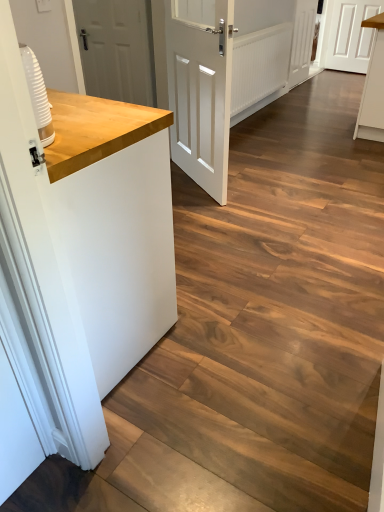
Question: Considering the relative sizes of wooden countertop at left and white matte door at center, which appears as the 3th door when viewed from the right, in the image provided, is wooden countertop at left thinner than white matte door at center, which appears as the 3th door when viewed from the right,?

Choices:
 (A) no
 (B) yes

Answer: (A)

Question: From a real-world perspective, is wooden countertop at left under white matte door at center, which appears as the 1th door when viewed from the front?

Choices:
 (A) no
 (B) yes

Answer: (B)

Question: Considering the relative sizes of wooden countertop at left and white matte door at center, acting as the second door starting from the left, in the image provided, is wooden countertop at left bigger than white matte door at center, acting as the second door starting from the left,?

Choices:
 (A) yes
 (B) no

Answer: (A)

Question: From a real-world perspective, is wooden countertop at left located higher than white matte door at center, acting as the second door starting from the left?

Choices:
 (A) yes
 (B) no

Answer: (B)

Question: Is white matte door at center, which appears as the 3th door when viewed from the right, surrounded by wooden countertop at left?

Choices:
 (A) no
 (B) yes

Answer: (A)

Question: From their relative heights in the image, would you say white matte door at upper left, which is the second door from front to back, is taller or shorter than white wooden door at upper right, positioned as the 1th door in right-to-left order?

Choices:
 (A) tall
 (B) short

Answer: (B)

Question: Considering their positions, is white matte door at upper left, the 3th door in the back-to-front sequence, located in front of or behind white wooden door at upper right, the 4th door in the front-to-back sequence?

Choices:
 (A) front
 (B) behind

Answer: (A)

Question: Looking at their shapes, would you say white matte door at upper left, which is the 4th door in right-to-left order, is wider or thinner than white wooden door at upper right, placed as the 4th door when sorted from left to right?

Choices:
 (A) thin
 (B) wide

Answer: (A)

Question: Would you say white matte door at upper left, which is the 4th door in right-to-left order, is to the left or to the right of white wooden door at upper right, placed as the 4th door when sorted from left to right, in the picture?

Choices:
 (A) left
 (B) right

Answer: (A)

Question: Based on their positions, is white matte door at upper left, which is the 4th door in right-to-left order, located to the left or right of white matte cabinet at upper right?

Choices:
 (A) left
 (B) right

Answer: (A)

Question: In terms of height, does white matte door at upper left, which is the 4th door in right-to-left order, look taller or shorter compared to white matte cabinet at upper right?

Choices:
 (A) tall
 (B) short

Answer: (B)

Question: Considering the positions of white matte door at upper left, which is the second door from front to back, and white matte cabinet at upper right in the image, is white matte door at upper left, which is the second door from front to back, wider or thinner than white matte cabinet at upper right?

Choices:
 (A) thin
 (B) wide

Answer: (A)

Question: Is white matte door at upper left, placed as the first door when sorted from left to right, in front of or behind white matte cabinet at upper right in the image?

Choices:
 (A) behind
 (B) front

Answer: (B)

Question: Looking at their shapes, would you say white matte cabinet at upper right is wider or thinner than white matte door at upper left, the 3th door in the back-to-front sequence?

Choices:
 (A) wide
 (B) thin

Answer: (A)

Question: Would you say white matte cabinet at upper right is to the left or to the right of white matte door at upper left, which is the 4th door in right-to-left order, in the picture?

Choices:
 (A) left
 (B) right

Answer: (B)